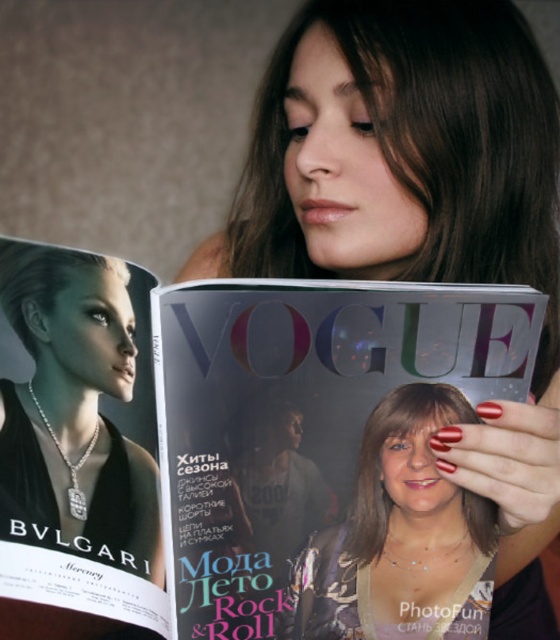
Question: Is matte silver magazine at center thinner than matte black magazine at center?

Choices:
 (A) yes
 (B) no

Answer: (A)

Question: Is the position of matte black magazine at center more distant than that of matte silver necklace at center?

Choices:
 (A) yes
 (B) no

Answer: (B)

Question: Which object is positioned farthest from the matte black magazine at center?

Choices:
 (A) matte silver magazine at center
 (B) matte silver necklace at center

Answer: (B)

Question: Does matte silver magazine at center have a greater width compared to matte silver necklace at center?

Choices:
 (A) no
 (B) yes

Answer: (B)

Question: Which point is closer to the camera?

Choices:
 (A) matte black magazine at center
 (B) matte silver necklace at center

Answer: (A)

Question: Which is nearer to the matte black magazine at center?

Choices:
 (A) matte silver magazine at center
 (B) matte silver necklace at center

Answer: (A)